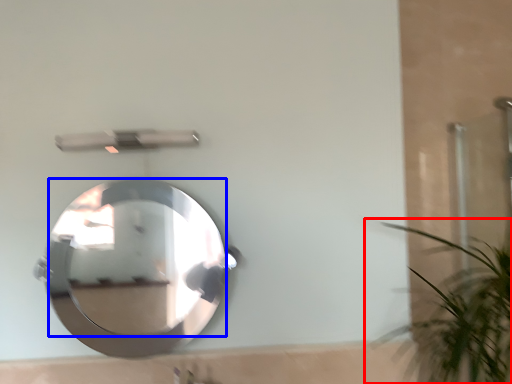
Question: Which point is closer to the camera, houseplant (highlighted by a red box) or mirror (highlighted by a blue box)?

Choices:
 (A) houseplant
 (B) mirror

Answer: (A)